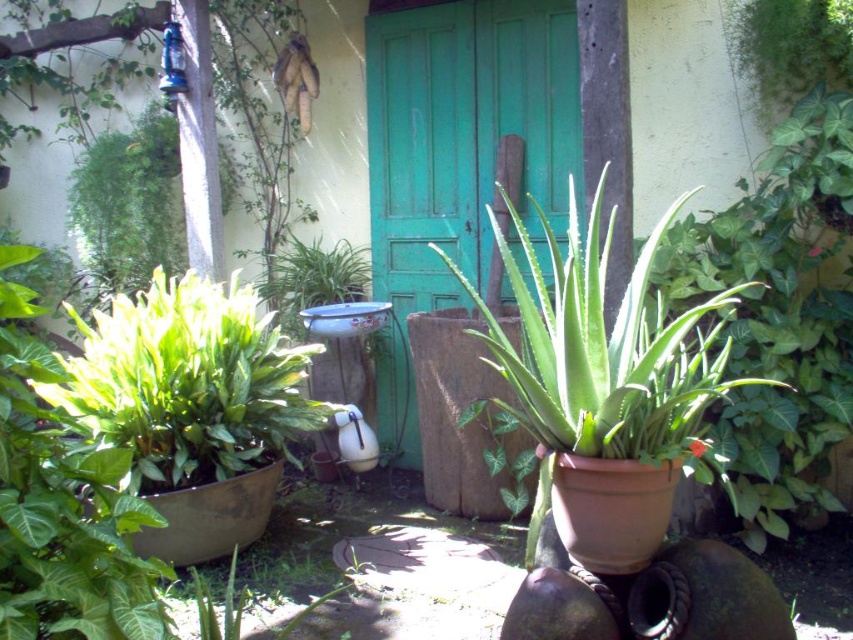
You are standing in the garden and want to walk towards the green wooden door at center and the green glossy leafy plant at left. Which object will you reach first?

You will reach the green glossy leafy plant at left first because it is closer to you than the green wooden door at center, which is further away.

You are standing in the garden scene looking at the rustic, green wooden door. There is a point marked at coordinates [463,134]. Which object does this point correspond to?

The point at coordinates [463,134] corresponds to the green wooden door at center.

You are a gardener who needs to water the green matte plant at center and the green glossy leafy plant at left. Your watering can has a 3.5 feet reach. Can you water both plants without moving your position?

The green matte plant at center is 3.66 feet from the green glossy leafy plant at left. Since the watering can only reaches 3.5 feet, you cannot water both plants without moving your position because the distance between them exceeds the watering can reach.